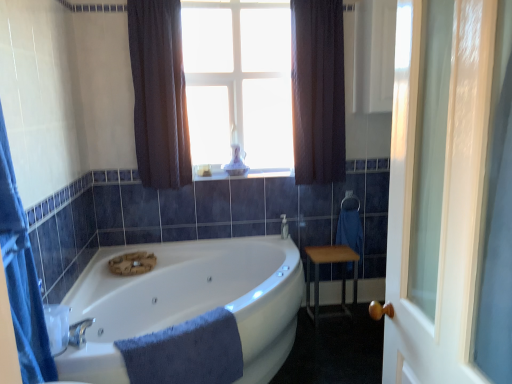
Question: From the image's perspective, would you say clear glass door at right is shown under dark fabric curtain at upper center, which is the second curtain in right-to-left order?

Choices:
 (A) no
 (B) yes

Answer: (B)

Question: Is clear glass door at right thinner than dark fabric curtain at upper center, arranged as the 1th curtain when viewed from the left?

Choices:
 (A) yes
 (B) no

Answer: (A)

Question: Considering the relative sizes of clear glass door at right and dark fabric curtain at upper center, arranged as the 1th curtain when viewed from the left, in the image provided, is clear glass door at right bigger than dark fabric curtain at upper center, arranged as the 1th curtain when viewed from the left,?

Choices:
 (A) no
 (B) yes

Answer: (B)

Question: Is clear glass door at right positioned far away from dark fabric curtain at upper center, arranged as the 1th curtain when viewed from the left?

Choices:
 (A) yes
 (B) no

Answer: (A)

Question: Is clear glass door at right to the left of dark fabric curtain at upper center, which is the second curtain in right-to-left order, from the viewer's perspective?

Choices:
 (A) yes
 (B) no

Answer: (B)

Question: From a real-world perspective, is clear glass door at right above or below transparent glass candle at upper center?

Choices:
 (A) below
 (B) above

Answer: (A)

Question: From the image's perspective, is clear glass door at right positioned above or below transparent glass candle at upper center?

Choices:
 (A) above
 (B) below

Answer: (B)

Question: Is point (397, 193) positioned closer to the camera than point (227, 158)?

Choices:
 (A) closer
 (B) farther

Answer: (A)

Question: Considering the relative positions of clear glass door at right and transparent glass candle at upper center in the image provided, is clear glass door at right to the left or to the right of transparent glass candle at upper center?

Choices:
 (A) right
 (B) left

Answer: (A)

Question: In terms of width, does white glossy bathtub at center look wider or thinner when compared to silver metallic towel bar at right?

Choices:
 (A) wide
 (B) thin

Answer: (A)

Question: Is white glossy bathtub at center inside the boundaries of silver metallic towel bar at right, or outside?

Choices:
 (A) outside
 (B) inside

Answer: (A)

Question: Considering their positions, is white glossy bathtub at center located in front of or behind silver metallic towel bar at right?

Choices:
 (A) behind
 (B) front

Answer: (B)

Question: Based on their positions, is white glossy bathtub at center located to the left or right of silver metallic towel bar at right?

Choices:
 (A) right
 (B) left

Answer: (B)

Question: Is dark fabric curtain at upper center, which is the second curtain in right-to-left order, to the left or to the right of transparent glass candle at upper center in the image?

Choices:
 (A) right
 (B) left

Answer: (B)

Question: Choose the correct answer: Is dark fabric curtain at upper center, arranged as the 1th curtain when viewed from the left, inside transparent glass candle at upper center or outside it?

Choices:
 (A) inside
 (B) outside

Answer: (B)